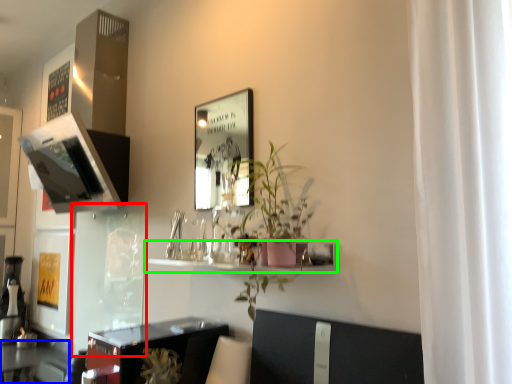
Question: Which is farther away from glass door (highlighted by a red box)? table (highlighted by a blue box) or shelf (highlighted by a green box)?

Choices:
 (A) table
 (B) shelf

Answer: (B)